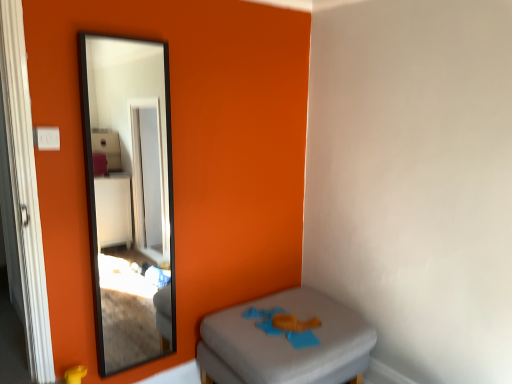
Question: From the image's perspective, is black glass mirror at upper left positioned above or below gray fabric ottoman at lower right?

Choices:
 (A) below
 (B) above

Answer: (B)

Question: Is black glass mirror at upper left in front of or behind gray fabric ottoman at lower right in the image?

Choices:
 (A) front
 (B) behind

Answer: (A)

Question: Which is correct: black glass mirror at upper left is inside gray fabric ottoman at lower right, or outside of it?

Choices:
 (A) outside
 (B) inside

Answer: (A)

Question: Is point (358, 322) positioned closer to the camera than point (124, 99)?

Choices:
 (A) closer
 (B) farther

Answer: (A)

Question: From a real-world perspective, is gray fabric ottoman at lower right above or below black glass mirror at upper left?

Choices:
 (A) below
 (B) above

Answer: (A)

Question: From the image's perspective, is gray fabric ottoman at lower right above or below black glass mirror at upper left?

Choices:
 (A) below
 (B) above

Answer: (A)

Question: Choose the correct answer: Is gray fabric ottoman at lower right inside black glass mirror at upper left or outside it?

Choices:
 (A) outside
 (B) inside

Answer: (A)